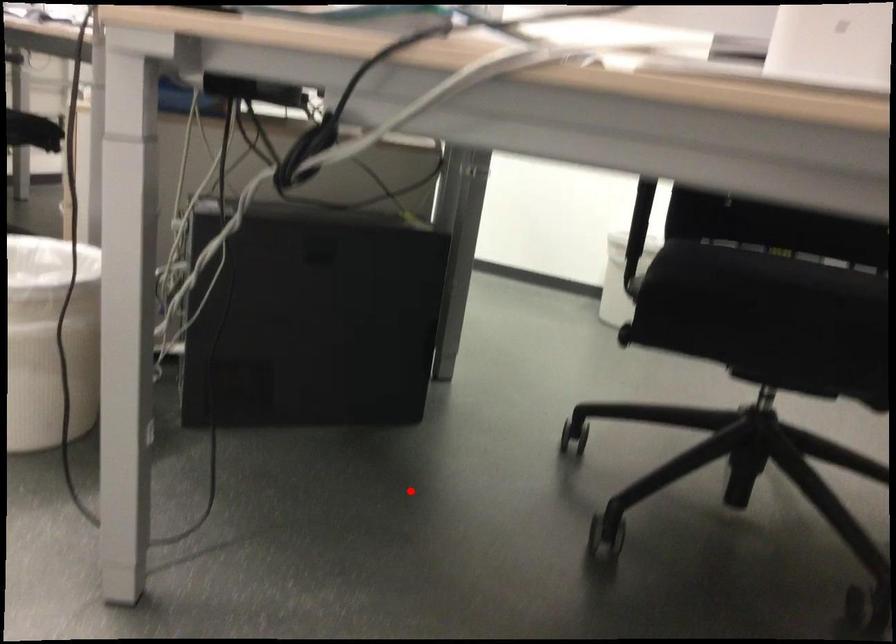
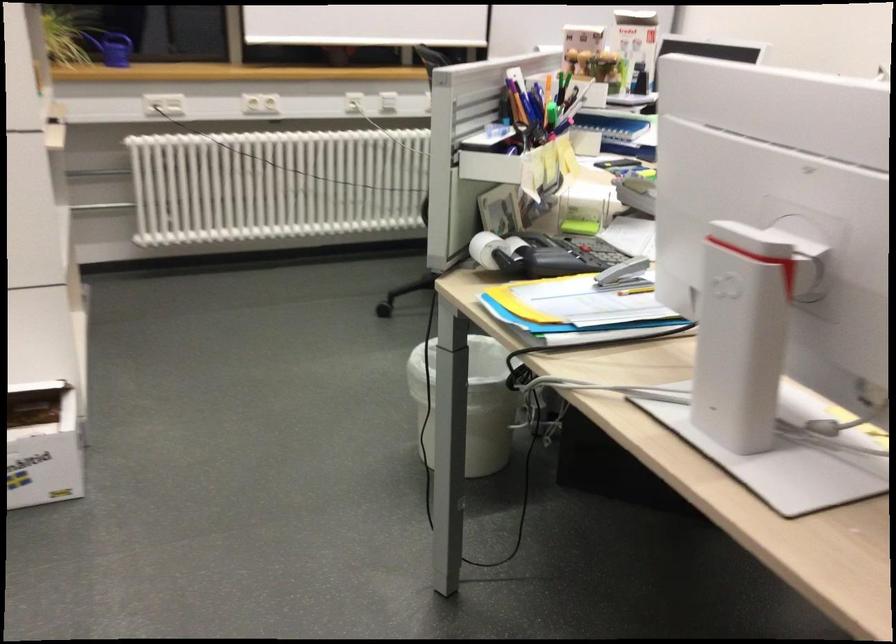
Question: I am providing you with two images of the same scene from different viewpoints. A red point is shown in image1. For the corresponding object point in image2, is it positioned nearer or farther from the camera?

Choices:
 (A) Nearer
 (B) Farther

Answer: (B)